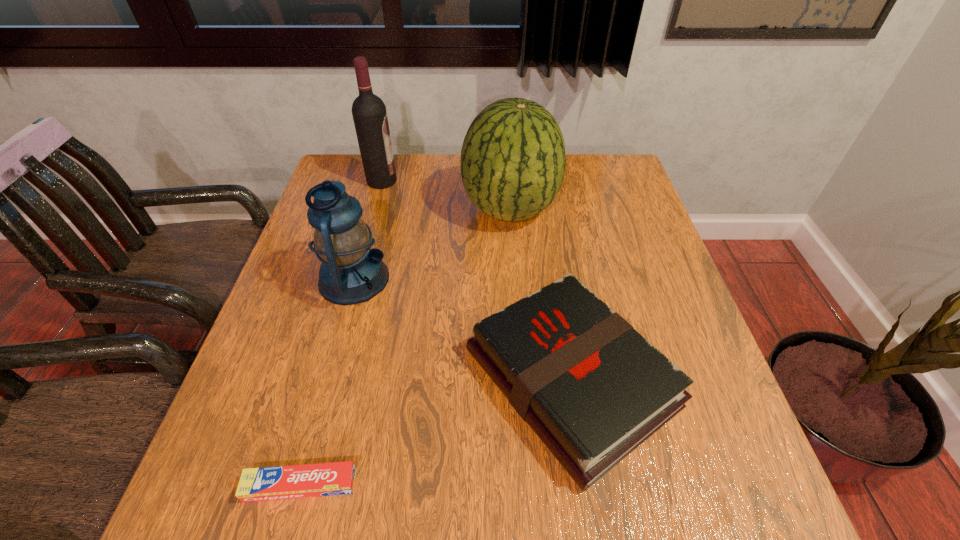
In order to click on object at the near right corner in this screenshot , I will do `click(593, 389)`.

Where is `vacant space at the far edge of the desktop`? This screenshot has height=540, width=960. vacant space at the far edge of the desktop is located at coordinates (419, 184).

The height and width of the screenshot is (540, 960). I want to click on blank space at the left edge, so click(237, 439).

In the image, there is a desktop. Identify the location of vacant space at the right edge. (629, 209).

In the image, there is a desktop. Identify the location of vacant space at the far right corner. This screenshot has width=960, height=540. pyautogui.click(x=610, y=173).

The height and width of the screenshot is (540, 960). Find the location of `vacant area at the near right corner`. vacant area at the near right corner is located at coordinates (722, 481).

The width and height of the screenshot is (960, 540). What are the coordinates of `vacant area between the lantern and the toothpaste` in the screenshot? It's located at (327, 382).

Where is `free spot between the watermelon and the lantern`? free spot between the watermelon and the lantern is located at coordinates (432, 245).

At what (x,y) coordinates should I click in order to perform the action: click on free space that is in between the wine bottle and the watermelon. Please return your answer as a coordinate pair (x, y). This screenshot has width=960, height=540. Looking at the image, I should click on (445, 195).

Locate an element on the screen. vacant space that is in between the watermelon and the toothpaste is located at coordinates (405, 347).